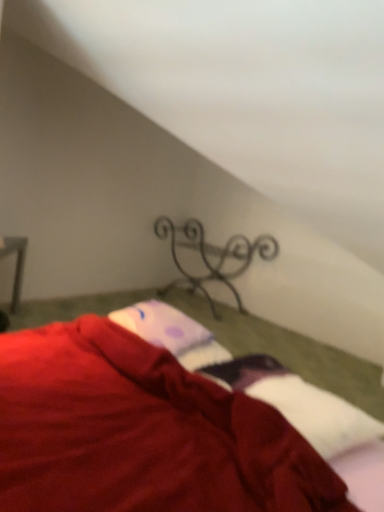
Question: Should I look upward or downward to see purple dotted fabric at center?

Choices:
 (A) up
 (B) down

Answer: (B)

Question: From the image's perspective, is metallic wrought iron at center on purple dotted fabric at center?

Choices:
 (A) yes
 (B) no

Answer: (A)

Question: Can you confirm if metallic wrought iron at center is positioned to the right of purple dotted fabric at center?

Choices:
 (A) no
 (B) yes

Answer: (B)

Question: Is metallic wrought iron at center bigger than purple dotted fabric at center?

Choices:
 (A) no
 (B) yes

Answer: (B)

Question: From a real-world perspective, is metallic wrought iron at center beneath purple dotted fabric at center?

Choices:
 (A) no
 (B) yes

Answer: (B)

Question: Is metallic wrought iron at center shorter than purple dotted fabric at center?

Choices:
 (A) yes
 (B) no

Answer: (B)

Question: From the image's perspective, does metallic wrought iron at center appear lower than purple dotted fabric at center?

Choices:
 (A) no
 (B) yes

Answer: (A)

Question: Is purple dotted fabric at center at the back of velvet red blanket at lower center?

Choices:
 (A) no
 (B) yes

Answer: (B)

Question: Does velvet red blanket at lower center have a greater height compared to purple dotted fabric at center?

Choices:
 (A) yes
 (B) no

Answer: (A)

Question: Does velvet red blanket at lower center have a smaller size compared to purple dotted fabric at center?

Choices:
 (A) no
 (B) yes

Answer: (A)

Question: From the image's perspective, does velvet red blanket at lower center appear lower than purple dotted fabric at center?

Choices:
 (A) yes
 (B) no

Answer: (A)

Question: Could you tell me if velvet red blanket at lower center is turned towards purple dotted fabric at center?

Choices:
 (A) no
 (B) yes

Answer: (A)

Question: Is velvet red blanket at lower center at the right side of purple dotted fabric at center?

Choices:
 (A) yes
 (B) no

Answer: (A)

Question: Can you confirm if metallic wrought iron at center is thinner than velvet red blanket at lower center?

Choices:
 (A) no
 (B) yes

Answer: (B)